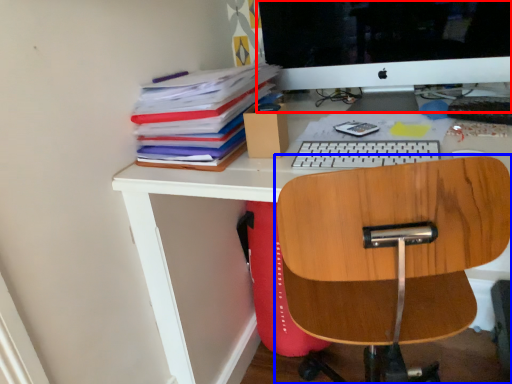
Question: Which of the following is the farthest to the observer, computer monitor (highlighted by a red box) or chair (highlighted by a blue box)?

Choices:
 (A) computer monitor
 (B) chair

Answer: (A)